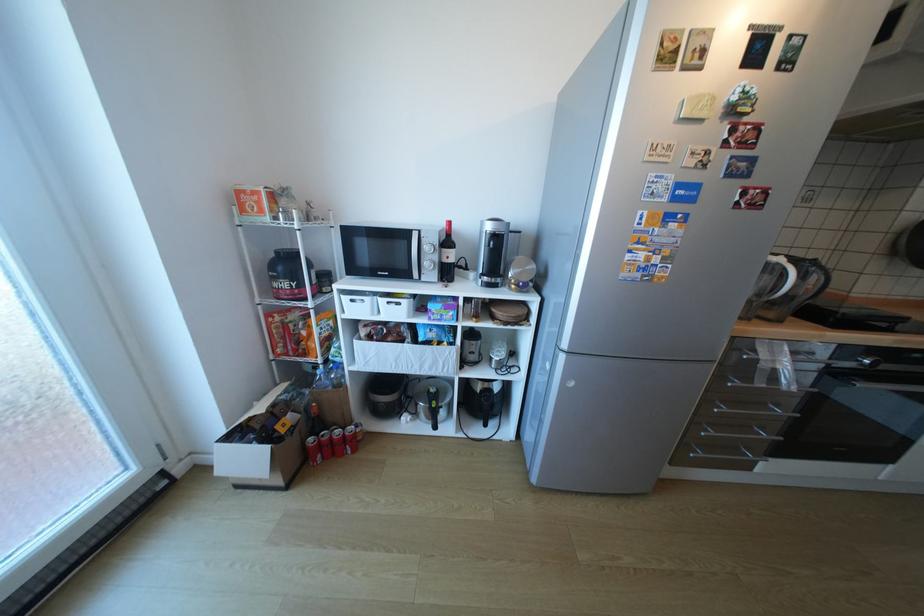
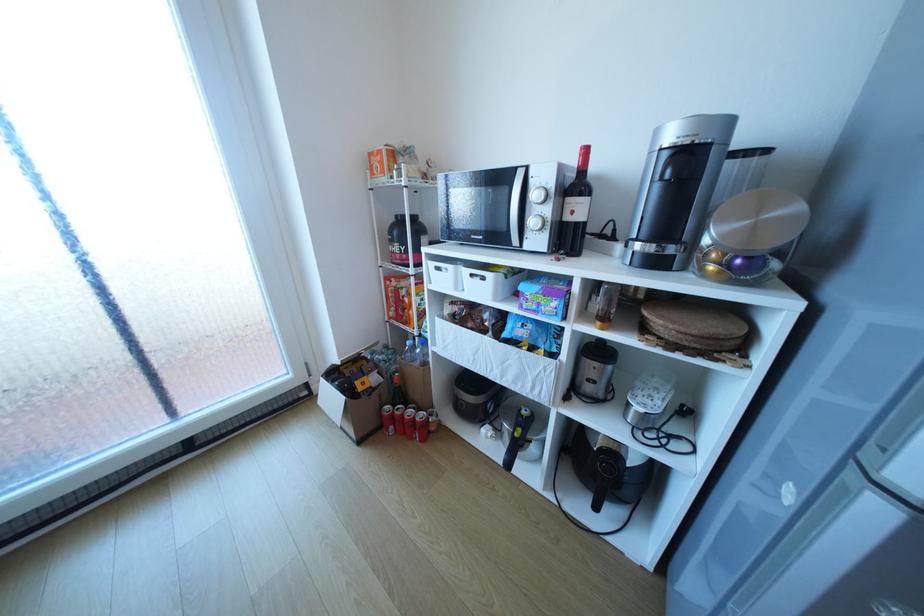
Where in the second image is the point corresponding to (x=361, y=301) from the first image?

(446, 268)